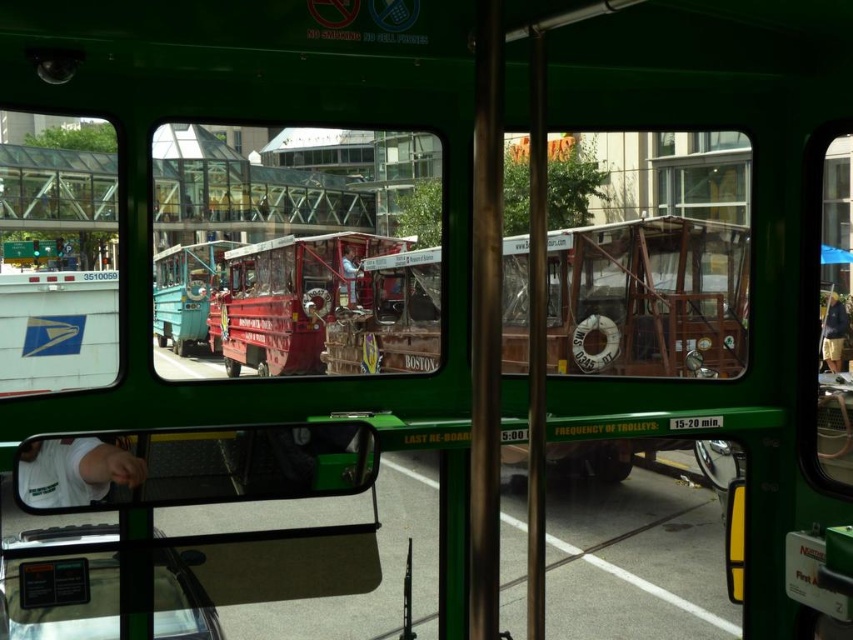
Between rusty wood decker bus at center and shiny red trolley at center, which one is positioned higher?

shiny red trolley at center

Does rusty wood decker bus at center have a greater height compared to shiny red trolley at center?

Indeed, rusty wood decker bus at center has a greater height compared to shiny red trolley at center.

You are a GUI agent. You are given a task and a screenshot of the screen. Output one action in this format:
    pyautogui.click(x=<x>, y=<y>)
    Task: Click on the rusty wood decker bus at center
    
    Given the screenshot: What is the action you would take?
    coord(647,298)

Where is `rusty wood decker bus at center`? The width and height of the screenshot is (853, 640). rusty wood decker bus at center is located at coordinates (647, 298).